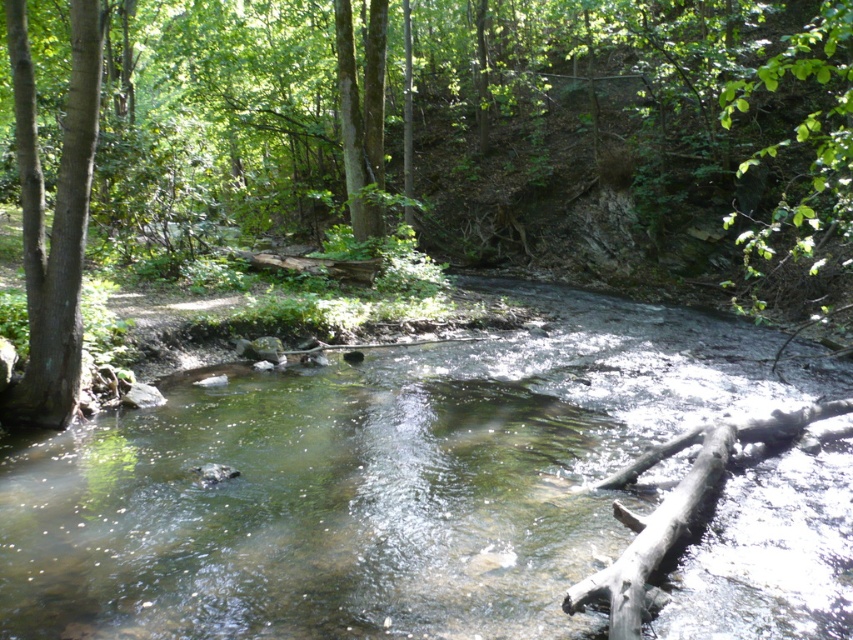
You are a hiker who wants to cross the stream using the green smooth tree trunk at left and the gray rough log at lower right. Which object should you step on first to cross the stream safely?

You should step on the gray rough log at lower right first because the green smooth tree trunk at left is located above it, meaning the log is closer to the ground and more accessible for crossing.

You are a hiker carrying a backpack and need to cross the stream. You see the green smooth tree trunk at left and the gray rough log at lower right. Which object is narrower and can be used as a stepping stone?

The green smooth tree trunk at left is narrower than the gray rough log at lower right, so it can be used as a stepping stone.

You are a hiker who wants to cross the stream at the center of the image. You see the clear water at center and the green smooth tree trunk at left. Which direction should you head towards to cross the stream safely?

You should head towards the clear water at center, as it is located to the right of the green smooth tree trunk at left, making it the correct direction to cross the stream safely.